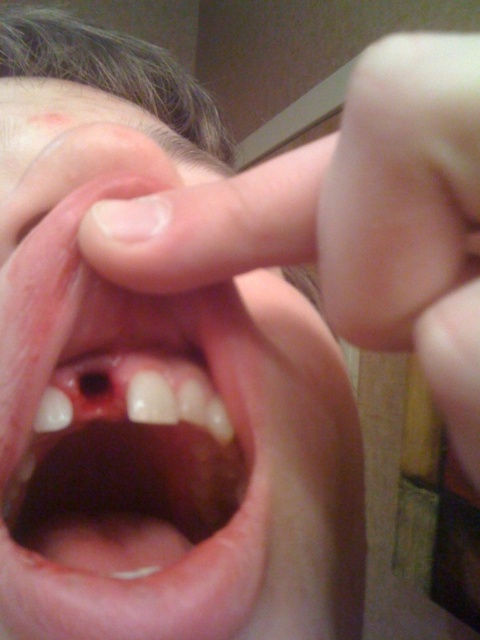
Question: Estimate the real-world distances between objects in this image. Which object is closer to the smooth flesh at upper right?

Choices:
 (A) smooth flesh-colored gums at center
 (B) pink flesh-colored mouth at center

Answer: (A)

Question: Which point is farther to the camera?

Choices:
 (A) (160, 454)
 (B) (403, 266)
 (C) (83, 580)

Answer: (A)

Question: Does pink flesh-colored mouth at center appear on the right side of smooth flesh at upper right?

Choices:
 (A) no
 (B) yes

Answer: (A)

Question: Which of the following is the farthest from the observer?

Choices:
 (A) pink flesh-colored mouth at center
 (B) smooth flesh-colored gums at center

Answer: (A)

Question: Does pink flesh-colored mouth at center appear on the left side of smooth flesh at upper right?

Choices:
 (A) no
 (B) yes

Answer: (B)

Question: Is pink flesh-colored mouth at center above smooth flesh-colored gums at center?

Choices:
 (A) no
 (B) yes

Answer: (B)